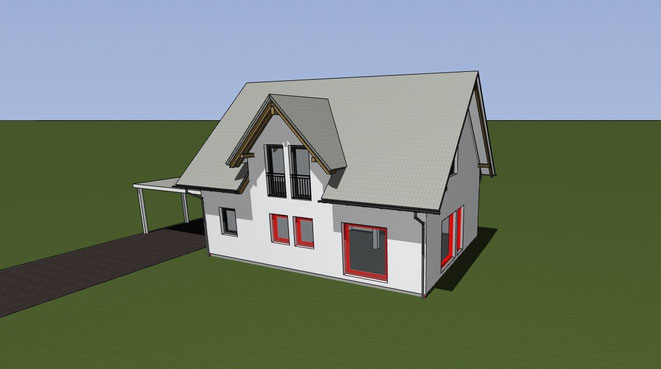
At what (x,y) coordinates should I click in order to perform the action: click on window. Please return your answer as a coordinate pair (x, y). The width and height of the screenshot is (661, 369). Looking at the image, I should click on (274, 162), (299, 159).